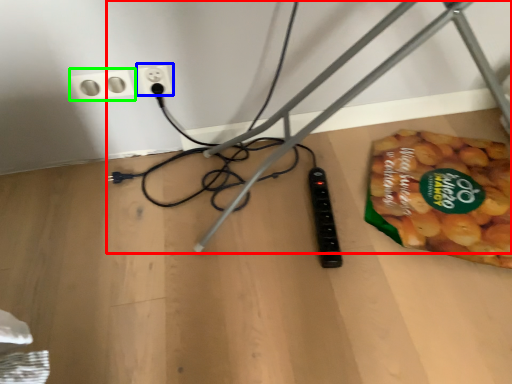
Question: Which object is the closest to the wire (highlighted by a red box)? Choose among these: power plugs and sockets (highlighted by a blue box) or power plugs and sockets (highlighted by a green box).

Choices:
 (A) power plugs and sockets
 (B) power plugs and sockets

Answer: (A)